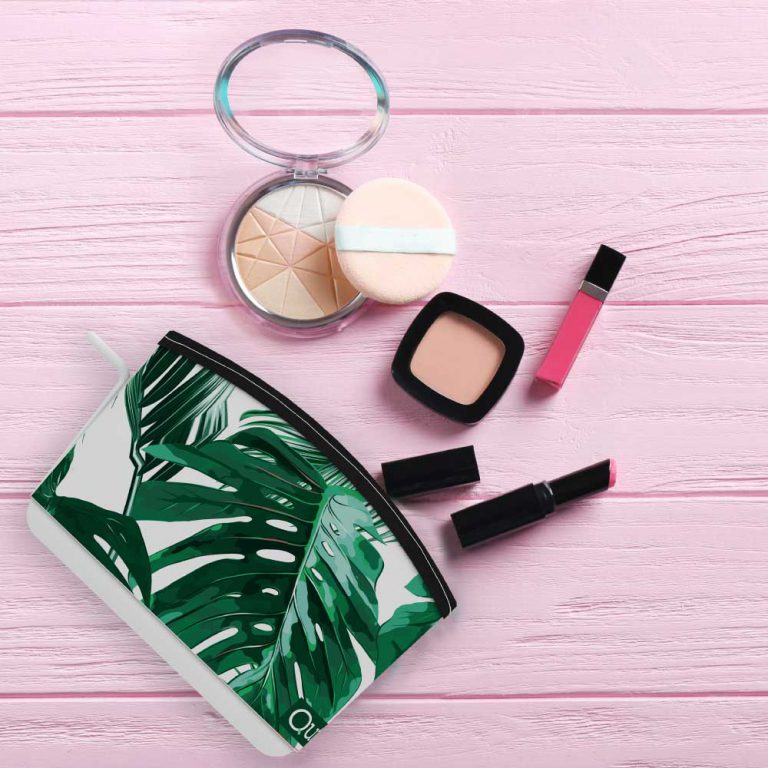
The height and width of the screenshot is (768, 768). I want to click on cosmetic bag, so click(x=313, y=531).